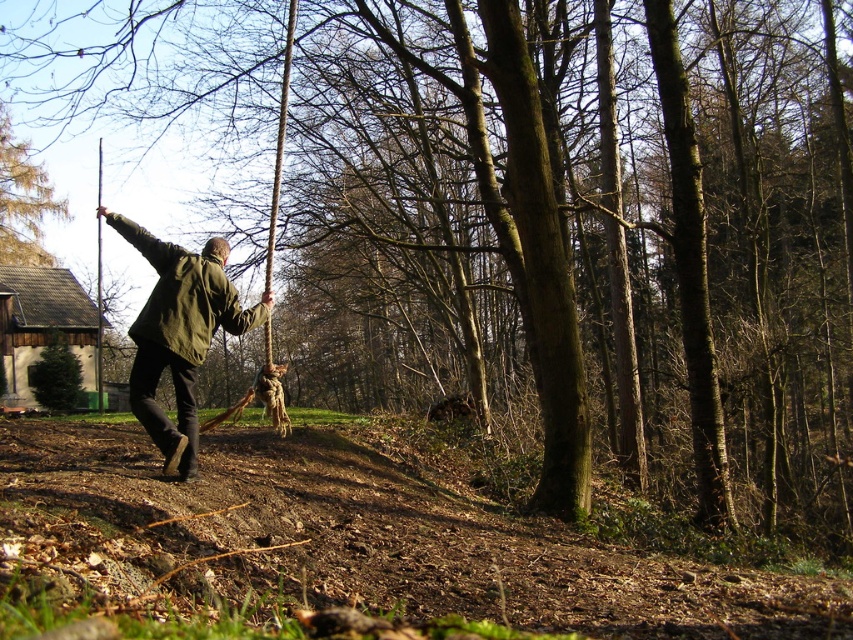
Measure the distance between point (219, 273) and camera.

They are 6.06 meters apart.

Which is above, green matte jacket at center or brown rough tree at upper left?

brown rough tree at upper left is above.

You are a GUI agent. You are given a task and a screenshot of the screen. Output one action in this format:
    pyautogui.click(x=<x>, y=<y>)
    Task: Click on the green matte jacket at center
    This screenshot has height=640, width=853.
    Given the screenshot: What is the action you would take?
    pyautogui.click(x=178, y=333)